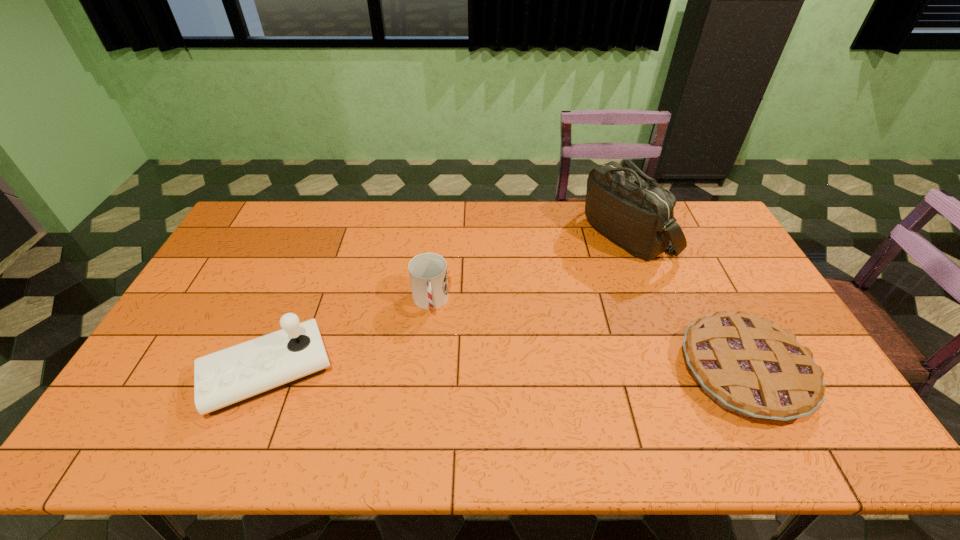
Find the location of a particular element. This screenshot has height=540, width=960. the leftmost object is located at coordinates (224, 379).

Locate an element on the screen. This screenshot has width=960, height=540. joystick is located at coordinates (224, 379).

Identify the location of pie. The image size is (960, 540). (748, 365).

Find the location of `shoulder bag`. shoulder bag is located at coordinates (632, 210).

The image size is (960, 540). Find the location of `the tallest object`. the tallest object is located at coordinates (632, 210).

Identify the location of cup. (428, 271).

Where is `the second shortest object`? the second shortest object is located at coordinates (428, 271).

This screenshot has width=960, height=540. What are the coordinates of `vacant region located on the back of the third shortest object` in the screenshot? It's located at (317, 251).

This screenshot has height=540, width=960. I want to click on free location located 0.120m on the back of the pie, so click(x=704, y=293).

Locate an element on the screen. The width and height of the screenshot is (960, 540). vacant space located at the front padded panel of the farthest object is located at coordinates (547, 318).